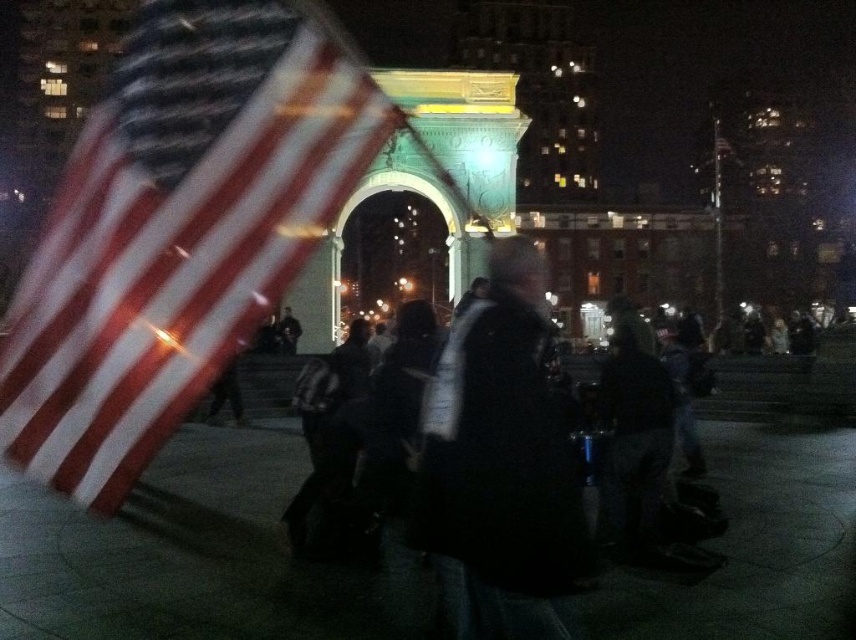
You are a photographer trying to capture both the dark gray jacket at center and the black matte jacket at center in a single frame. Which jacket should you adjust your camera focus to first to ensure both are in the frame?

Since the dark gray jacket at center is to the right of the black matte jacket at center, you should focus on the black matte jacket at center first as it is positioned to the left, ensuring the rightward jacket remains within the frame.